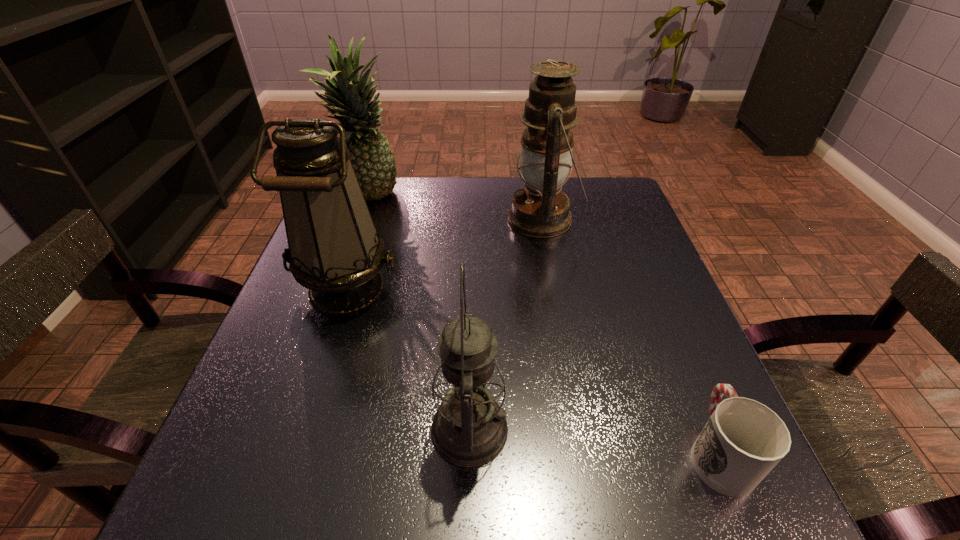
Find the location of `vacant space located on the right of the second object from right to left`. vacant space located on the right of the second object from right to left is located at coordinates (617, 219).

At what (x,y) coordinates should I click in order to perform the action: click on free location located 0.210m on the right of the second farthest oil lamp. Please return your answer as a coordinate pair (x, y). The height and width of the screenshot is (540, 960). Looking at the image, I should click on (496, 288).

Where is `vacant region located on the left of the nearest oil lamp`? vacant region located on the left of the nearest oil lamp is located at coordinates (400, 430).

This screenshot has width=960, height=540. Find the location of `vacant region located on the handle side of the rightmost object`. vacant region located on the handle side of the rightmost object is located at coordinates (638, 260).

You are a GUI agent. You are given a task and a screenshot of the screen. Output one action in this format:
    pyautogui.click(x=<x>, y=<y>)
    Task: Click on the vacant space located on the handle side of the rightmost object
    The width and height of the screenshot is (960, 540).
    Given the screenshot: What is the action you would take?
    pyautogui.click(x=652, y=292)

Locate an element on the screen. The image size is (960, 540). vacant space situated on the handle side of the rightmost object is located at coordinates (649, 286).

Identify the location of pineapple present at the far edge. The image size is (960, 540). (371, 155).

Find the location of a particular element. The width and height of the screenshot is (960, 540). lantern that is positioned at the far edge is located at coordinates (541, 210).

At what (x,y) coordinates should I click in order to perform the action: click on oil lamp located in the near edge section of the desktop. Please return your answer as a coordinate pair (x, y). Looking at the image, I should click on (469, 429).

Where is `cup situated at the near edge`? The height and width of the screenshot is (540, 960). cup situated at the near edge is located at coordinates (743, 440).